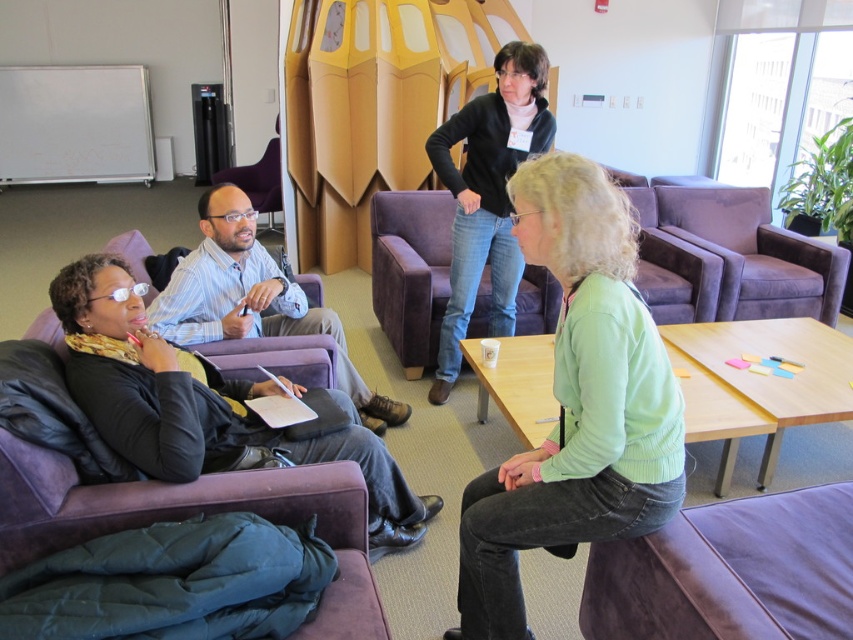
You are an office worker who needs to place a new plant pot between the green knitwear at center and the purple velvet chair at center. Based on their positions, which object should the plant pot be closer to?

The green knitwear at center is to the right of the purple velvet chair at center, so the plant pot should be placed closer to the purple velvet chair at center to maintain symmetry between the two objects.

You are a photographer trying to capture a closeup of the two points in the image. Which point, point (490, 550) or point (402, 227), is closer to your camera lens?

Point (490, 550) is closer to the camera lens than point (402, 227).

You are organizing a meeting in this room and need to seat two guests who require ample legroom. The guests have specified they need chairs that are wider than average. Based on the scene, which chair between the purple velvet chair at center and the matte purple armchair at center would you choose for them?

The purple velvet chair at center is wider than the matte purple armchair at center, so it would be the better choice for guests requiring more legroom.